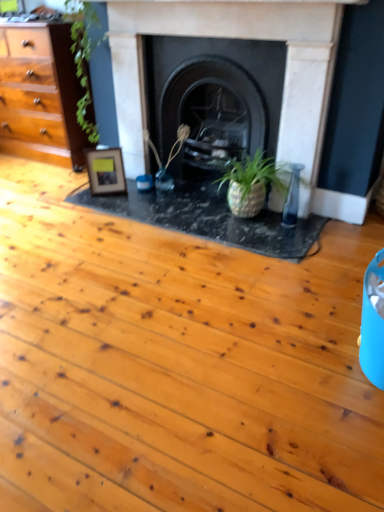
This screenshot has width=384, height=512. Describe the element at coordinates (170, 151) in the screenshot. I see `green matte plant at center` at that location.

Image resolution: width=384 pixels, height=512 pixels. What do you see at coordinates (233, 37) in the screenshot?
I see `marble fireplace at center, the second fireplace in the right-to-left sequence` at bounding box center [233, 37].

Measure the distance between point (133,76) and camera.

Point (133,76) and camera are 2.69 meters apart.

This screenshot has width=384, height=512. I want to click on green matte plant at center, so click(170, 151).

Does point (112, 162) lie behind point (170, 158)?

That is False.

Locate an element on the screen. The width and height of the screenshot is (384, 512). plant above the wooden photo frame at center left (from the image's perspective) is located at coordinates (170, 151).

Considering the sizes of objects wooden photo frame at center left and green matte plant at center in the image provided, who is wider, wooden photo frame at center left or green matte plant at center?

With larger width is green matte plant at center.

Is marble fireplace at center, which ranks as the 1th fireplace in left-to-right order, not inside green matte plant at center?

marble fireplace at center, which ranks as the 1th fireplace in left-to-right order, is positioned outside green matte plant at center.

Looking at this image, based on their positions, is marble fireplace at center, which ranks as the 1th fireplace in left-to-right order, located to the left or right of green matte plant at center?

Clearly, marble fireplace at center, which ranks as the 1th fireplace in left-to-right order, is on the right of green matte plant at center in the image.

How different are the orientations of marble fireplace at center, the second fireplace in the right-to-left sequence, and green matte plant at center in degrees?

24.4 degrees separate the facing orientations of marble fireplace at center, the second fireplace in the right-to-left sequence, and green matte plant at center.

Is point (155, 26) behind point (185, 133)?

No, it is in front of (185, 133).

Which point is more forward, (129, 102) or (98, 194)?

The point (98, 194) is closer.

Considering the sizes of objects marble fireplace at center, the second fireplace in the right-to-left sequence, and wooden photo frame at center left in the image provided, who is wider, marble fireplace at center, the second fireplace in the right-to-left sequence, or wooden photo frame at center left?

With larger width is wooden photo frame at center left.

From the image's perspective, is marble fireplace at center, the second fireplace in the right-to-left sequence, beneath wooden photo frame at center left?

No.

Is marble fireplace at center, the second fireplace in the right-to-left sequence, positioned with its back to wooden photo frame at center left?

No, wooden photo frame at center left is not at the back of marble fireplace at center, the second fireplace in the right-to-left sequence.

Identify the location of the 1st fireplace positioned above the wooden photo frame at center left (from the image's perspective). The width and height of the screenshot is (384, 512). (233, 37).

Does wooden photo frame at center left touch marble fireplace at center, which ranks as the 1th fireplace in left-to-right order?

No, wooden photo frame at center left is not next to marble fireplace at center, which ranks as the 1th fireplace in left-to-right order.

Is wooden photo frame at center left not within marble fireplace at center, which ranks as the 1th fireplace in left-to-right order?

Yes, wooden photo frame at center left is outside of marble fireplace at center, which ranks as the 1th fireplace in left-to-right order.

Based on their positions, is wooden photo frame at center left located to the left or right of marble fireplace at center, which ranks as the 1th fireplace in left-to-right order?

Based on their positions, wooden photo frame at center left is located to the left of marble fireplace at center, which ranks as the 1th fireplace in left-to-right order.

The height and width of the screenshot is (512, 384). Identify the location of the 2nd fireplace above when counting from the wooden photo frame at center left (from the image's perspective). (215, 90).

From their relative heights in the image, would you say wooden photo frame at center left is taller or shorter than black stone fireplace at center, arranged as the first fireplace when viewed from the right?

Clearly, wooden photo frame at center left is shorter compared to black stone fireplace at center, arranged as the first fireplace when viewed from the right.

Is point (86, 151) less distant than point (236, 70)?

No, it is behind (236, 70).

Is point (173, 58) positioned after point (149, 142)?

No, it is not.

In the scene shown: Relative to green matte plant at center, is black stone fireplace at center, the 2th fireplace when ordered from left to right, in front or behind?

In the image, black stone fireplace at center, the 2th fireplace when ordered from left to right, appears in front of green matte plant at center.

From a real-world perspective, is black stone fireplace at center, arranged as the first fireplace when viewed from the right, over green matte plant at center?

Yes, from a real-world perspective, black stone fireplace at center, arranged as the first fireplace when viewed from the right, is above green matte plant at center.

From the image's perspective, which object appears higher, black stone fireplace at center, arranged as the first fireplace when viewed from the right, or green matte plant at center?

black stone fireplace at center, arranged as the first fireplace when viewed from the right, is shown above in the image.

Is marble fireplace at center, which ranks as the 1th fireplace in left-to-right order, taller or shorter than black stone fireplace at center, arranged as the first fireplace when viewed from the right?

marble fireplace at center, which ranks as the 1th fireplace in left-to-right order, is taller than black stone fireplace at center, arranged as the first fireplace when viewed from the right.

Does marble fireplace at center, which ranks as the 1th fireplace in left-to-right order, have a greater width compared to black stone fireplace at center, the 2th fireplace when ordered from left to right?

In fact, marble fireplace at center, which ranks as the 1th fireplace in left-to-right order, might be narrower than black stone fireplace at center, the 2th fireplace when ordered from left to right.

Based on the photo, considering the positions of objects marble fireplace at center, the second fireplace in the right-to-left sequence, and black stone fireplace at center, arranged as the first fireplace when viewed from the right, in the image provided, who is behind, marble fireplace at center, the second fireplace in the right-to-left sequence, or black stone fireplace at center, arranged as the first fireplace when viewed from the right,?

Positioned behind is black stone fireplace at center, arranged as the first fireplace when viewed from the right.

Between point (316, 134) and point (167, 78), which one is positioned behind?

The point (167, 78) is farther.

Identify the location of picture frame that is behind the green matte plant at center. The image size is (384, 512). (105, 170).

Where is `fireplace that is the 2nd object located in front of the green matte plant at center`? fireplace that is the 2nd object located in front of the green matte plant at center is located at coordinates (233, 37).

Looking at the image, which one is located further to wooden photo frame at center left, black stone fireplace at center, arranged as the first fireplace when viewed from the right, or marble fireplace at center, which ranks as the 1th fireplace in left-to-right order?

Among the two, black stone fireplace at center, arranged as the first fireplace when viewed from the right, is located further to wooden photo frame at center left.

Considering their positions, is wooden photo frame at center left positioned further to black stone fireplace at center, arranged as the first fireplace when viewed from the right, than marble fireplace at center, the second fireplace in the right-to-left sequence?

Based on the image, wooden photo frame at center left appears to be further to black stone fireplace at center, arranged as the first fireplace when viewed from the right.

Considering their positions, is black stone fireplace at center, arranged as the first fireplace when viewed from the right, positioned closer to green matte plant at center than wooden photo frame at center left?

wooden photo frame at center left is closer to green matte plant at center.

Estimate the real-world distances between objects in this image. Which object is closer to marble fireplace at center, which ranks as the 1th fireplace in left-to-right order, green matte plant at center or black stone fireplace at center, arranged as the first fireplace when viewed from the right?

black stone fireplace at center, arranged as the first fireplace when viewed from the right, is closer to marble fireplace at center, which ranks as the 1th fireplace in left-to-right order.

Considering their positions, is wooden photo frame at center left positioned closer to marble fireplace at center, which ranks as the 1th fireplace in left-to-right order, than green matte plant at center?

The object closer to marble fireplace at center, which ranks as the 1th fireplace in left-to-right order, is green matte plant at center.

Which object lies nearer to the anchor point green matte plant at center, wooden photo frame at center left or black stone fireplace at center, arranged as the first fireplace when viewed from the right?

wooden photo frame at center left is closer to green matte plant at center.

From the image, which object appears to be farther from green matte plant at center, marble fireplace at center, the second fireplace in the right-to-left sequence, or black stone fireplace at center, arranged as the first fireplace when viewed from the right?

Based on the image, marble fireplace at center, the second fireplace in the right-to-left sequence, appears to be further to green matte plant at center.

Consider the image. Based on their spatial positions, is green matte plant at center or marble fireplace at center, which ranks as the 1th fireplace in left-to-right order, closer to wooden photo frame at center left?

green matte plant at center is closer to wooden photo frame at center left.

Locate an element on the screen. The height and width of the screenshot is (512, 384). fireplace between wooden photo frame at center left and black stone fireplace at center, the 2th fireplace when ordered from left to right, in the horizontal direction is located at coordinates (233, 37).

Where is `plant between marble fireplace at center, the second fireplace in the right-to-left sequence, and wooden photo frame at center left from front to back`? The image size is (384, 512). plant between marble fireplace at center, the second fireplace in the right-to-left sequence, and wooden photo frame at center left from front to back is located at coordinates (170, 151).

The height and width of the screenshot is (512, 384). I want to click on fireplace positioned between marble fireplace at center, which ranks as the 1th fireplace in left-to-right order, and green matte plant at center from near to far, so click(215, 90).

Where is `plant situated between wooden photo frame at center left and black stone fireplace at center, the 2th fireplace when ordered from left to right, from left to right`? plant situated between wooden photo frame at center left and black stone fireplace at center, the 2th fireplace when ordered from left to right, from left to right is located at coordinates (170, 151).